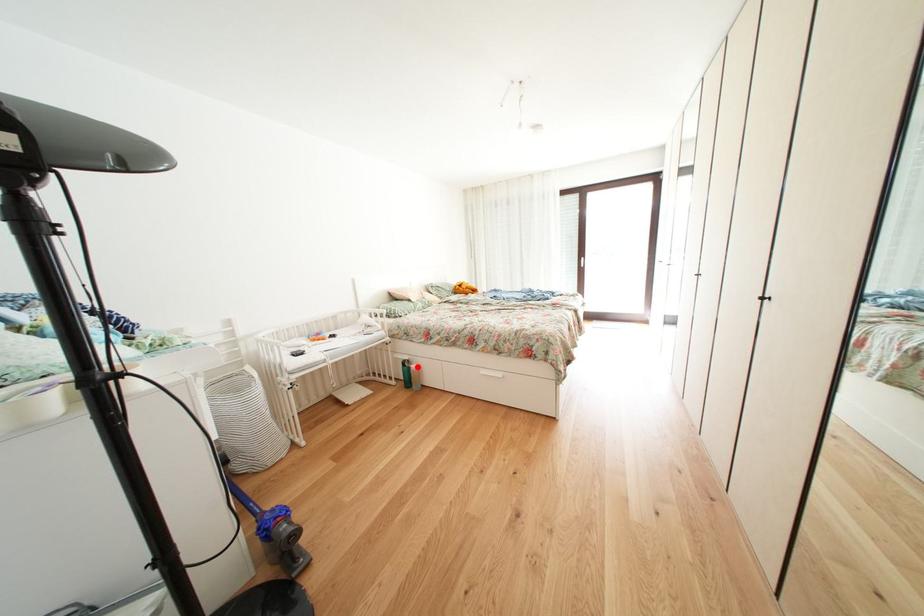
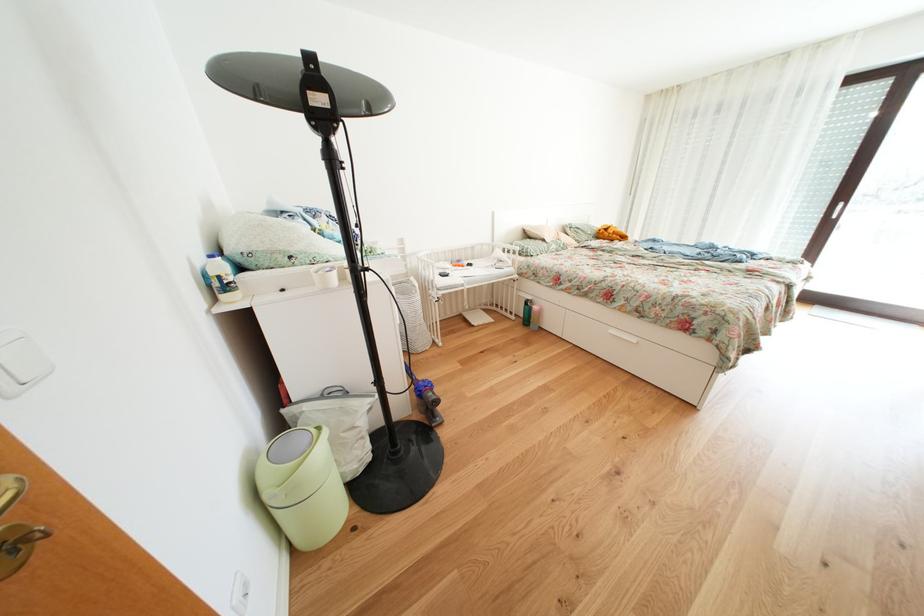
Locate, in the second image, the point that corresponds to the highlighted location in the first image.

(541, 307)